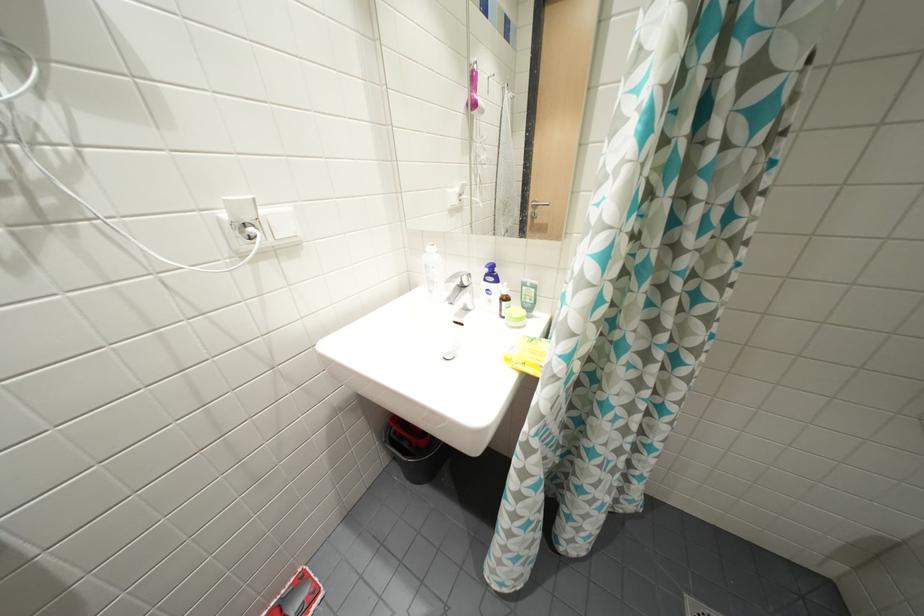
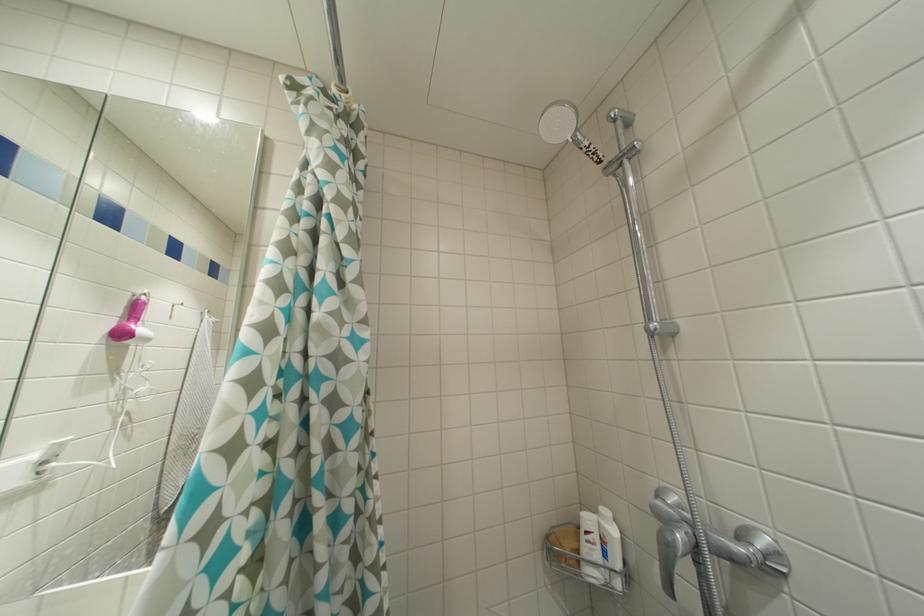
The images are taken continuously from a first-person perspective. In which direction is your viewpoint rotating?

The camera rotated toward right-up.